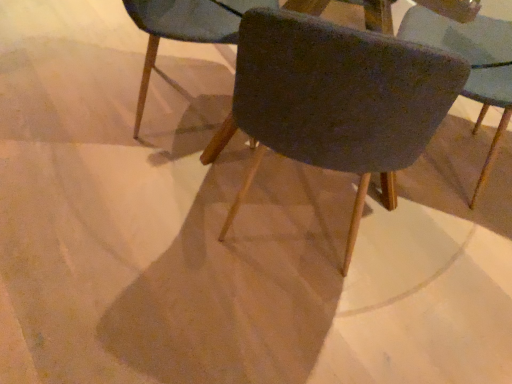
Question: Is velvet dark blue chair at center, the 1th chair in the left-to-right sequence, to the left of velvet dark blue chair at center, placed as the 2th chair when sorted from left to right, from the viewer's perspective?

Choices:
 (A) yes
 (B) no

Answer: (A)

Question: Does velvet dark blue chair at center, the 3th chair from the right, contain velvet dark blue chair at center, placed as the 2th chair when sorted from left to right?

Choices:
 (A) no
 (B) yes

Answer: (A)

Question: Can you confirm if velvet dark blue chair at center, the 3th chair from the right, is bigger than velvet dark blue chair at center, placed as the 2th chair when sorted from left to right?

Choices:
 (A) no
 (B) yes

Answer: (A)

Question: From a real-world perspective, does velvet dark blue chair at center, the 1th chair in the left-to-right sequence, stand above velvet dark blue chair at center, placed as the 2th chair when sorted from left to right?

Choices:
 (A) yes
 (B) no

Answer: (B)

Question: Can you confirm if velvet dark blue chair at center, the 1th chair in the left-to-right sequence, is thinner than velvet dark blue chair at center, placed as the 2th chair when sorted from left to right?

Choices:
 (A) yes
 (B) no

Answer: (A)

Question: In terms of size, does velvet dark blue chair at center, which is the 1th chair from right to left, appear bigger or smaller than velvet dark blue chair at center, the second chair when ordered from right to left?

Choices:
 (A) big
 (B) small

Answer: (B)

Question: Is velvet dark blue chair at center, the 3th chair viewed from the left, spatially inside velvet dark blue chair at center, placed as the 2th chair when sorted from left to right, or outside of it?

Choices:
 (A) inside
 (B) outside

Answer: (B)

Question: Is velvet dark blue chair at center, which is the 1th chair from right to left, wider or thinner than velvet dark blue chair at center, the second chair when ordered from right to left?

Choices:
 (A) wide
 (B) thin

Answer: (B)

Question: In the image, is velvet dark blue chair at center, which is the 1th chair from right to left, positioned in front of or behind velvet dark blue chair at center, placed as the 2th chair when sorted from left to right?

Choices:
 (A) behind
 (B) front

Answer: (A)

Question: Is velvet dark blue chair at center, the 3th chair from the right, situated inside velvet dark blue chair at center, the second chair when ordered from right to left, or outside?

Choices:
 (A) outside
 (B) inside

Answer: (A)

Question: From a real-world perspective, relative to velvet dark blue chair at center, the second chair when ordered from right to left, is velvet dark blue chair at center, the 1th chair in the left-to-right sequence, vertically above or below?

Choices:
 (A) above
 (B) below

Answer: (B)

Question: Is point (244, 8) closer or farther from the camera than point (250, 11)?

Choices:
 (A) farther
 (B) closer

Answer: (A)

Question: Is velvet dark blue chair at center, the 1th chair in the left-to-right sequence, in front of or behind velvet dark blue chair at center, the second chair when ordered from right to left, in the image?

Choices:
 (A) front
 (B) behind

Answer: (B)

Question: In the image, is velvet dark blue chair at center, which is the 1th chair from right to left, on the left side or the right side of velvet dark blue chair at center, the 1th chair in the left-to-right sequence?

Choices:
 (A) right
 (B) left

Answer: (A)

Question: Considering their positions, is velvet dark blue chair at center, the 3th chair viewed from the left, located in front of or behind velvet dark blue chair at center, the 1th chair in the left-to-right sequence?

Choices:
 (A) behind
 (B) front

Answer: (B)